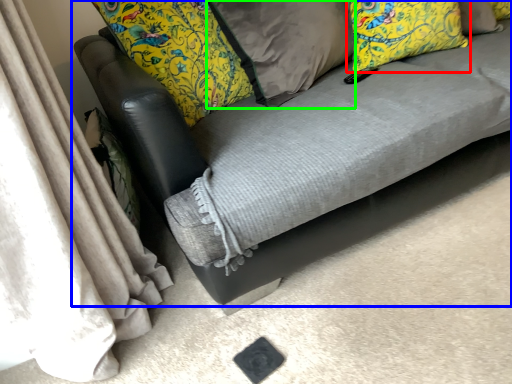
Question: Considering the real-world distances, which object is closest to pillow (highlighted by a red box)? studio couch (highlighted by a blue box) or pillow (highlighted by a green box).

Choices:
 (A) studio couch
 (B) pillow

Answer: (B)